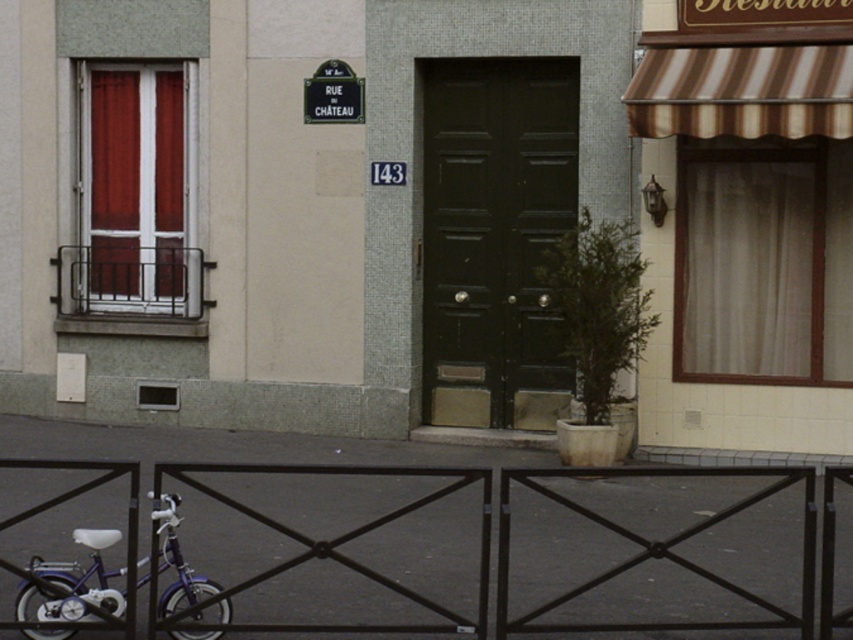
You are a delivery person trying to determine the best place to park your van. You need to ensure there is enough space between the black metal fence at lower center and the green metal sign at upper center to avoid damaging either. Can you fit your van between them?

The black metal fence at lower center is larger than the green metal sign at upper center, so there is sufficient space between them to park your van without damaging either object.